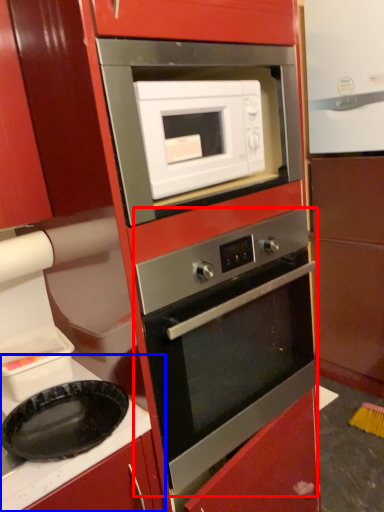
Question: Which point is further to the camera, oven (highlighted by a red box) or counter top (highlighted by a blue box)?

Choices:
 (A) oven
 (B) counter top

Answer: (A)